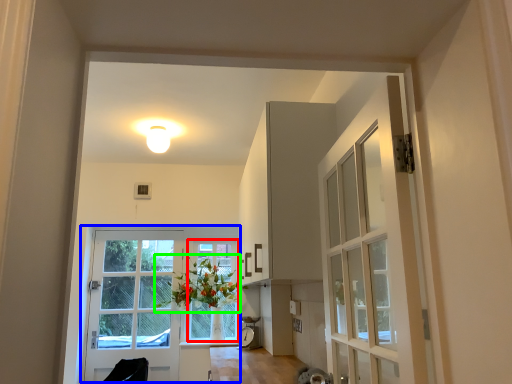
Question: Which object is the farthest from window frame (highlighted by a red box)? Choose among these: door (highlighted by a blue box) or floral arrangement (highlighted by a green box).

Choices:
 (A) door
 (B) floral arrangement

Answer: (A)